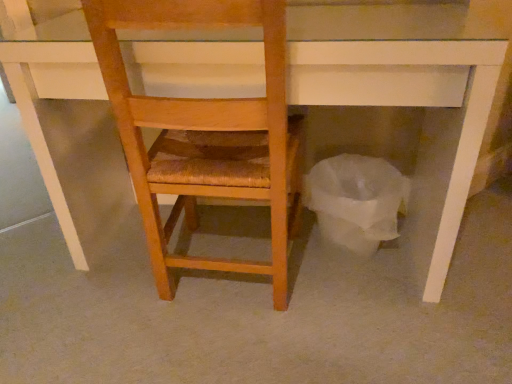
In order to click on free space to the right of white paper bag at lower right in this screenshot , I will do `click(449, 262)`.